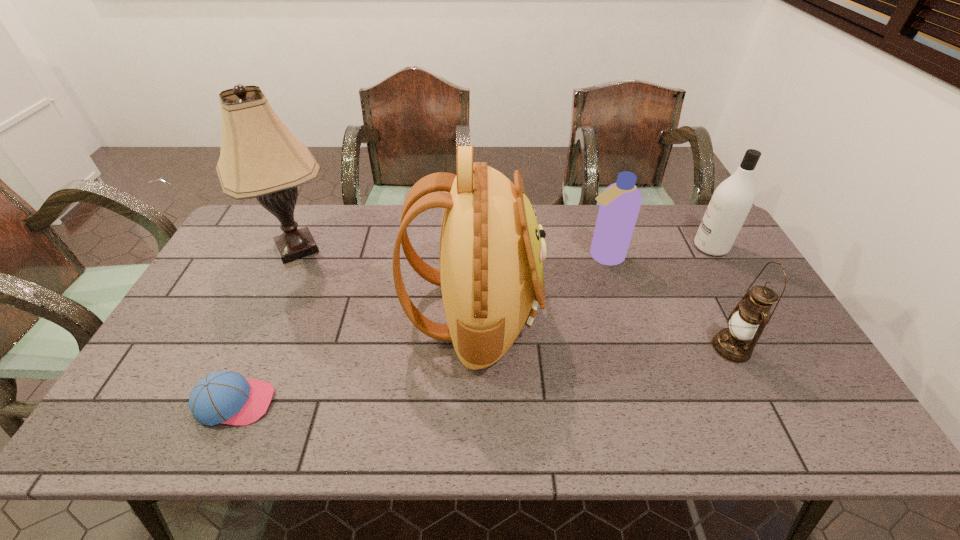
Where is `lamp`? This screenshot has width=960, height=540. lamp is located at coordinates (260, 158).

Identify the location of the third object from left to right. The width and height of the screenshot is (960, 540). (492, 249).

Identify the location of the right shampoo. (732, 200).

In order to click on the shorter shampoo in this screenshot , I will do `click(620, 203)`.

At what (x,y) coordinates should I click in order to perform the action: click on the third object from right to left. Please return your answer as a coordinate pair (x, y). The width and height of the screenshot is (960, 540). Looking at the image, I should click on (620, 203).

Locate an element on the screen. Image resolution: width=960 pixels, height=540 pixels. oil lamp is located at coordinates (747, 321).

I want to click on the shortest object, so click(226, 397).

Where is `vacant space located 0.240m on the front of the lamp`? The image size is (960, 540). vacant space located 0.240m on the front of the lamp is located at coordinates (252, 346).

Image resolution: width=960 pixels, height=540 pixels. What are the coordinates of `vacant region located on the front-facing side of the backpack` in the screenshot? It's located at (608, 313).

Identify the location of free point located on the front-facing side of the right shampoo. (660, 247).